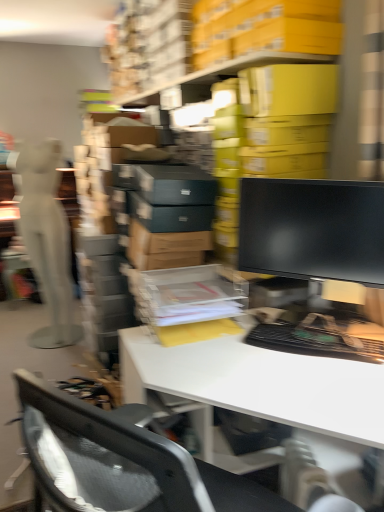
Question: Based on their sizes in the image, would you say white matte mannequin at left is bigger or smaller than black glossy monitor at center?

Choices:
 (A) small
 (B) big

Answer: (B)

Question: From a real-world perspective, relative to black glossy monitor at center, is white matte mannequin at left vertically above or below?

Choices:
 (A) above
 (B) below

Answer: (B)

Question: Which of these objects is positioned closest to the white matte mannequin at left?

Choices:
 (A) white glossy desk at center
 (B) black glossy monitor at center

Answer: (A)

Question: Estimate the real-world distances between objects in this image. Which object is farther from the white matte mannequin at left?

Choices:
 (A) black glossy monitor at center
 (B) white glossy desk at center

Answer: (A)